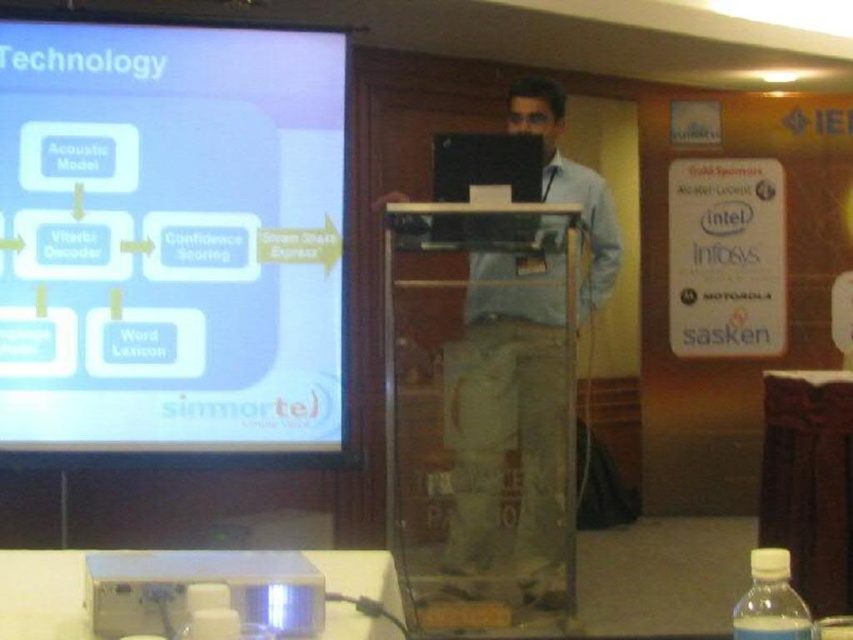
Does white plastic projector at lower left appear over clear plastic bottle at lower right?

Actually, white plastic projector at lower left is below clear plastic bottle at lower right.

Find the location of a particular element. white plastic projector at lower left is located at coordinates (202, 582).

Which is in front, point (252, 596) or point (763, 580)?

Point (763, 580) is more forward.

The height and width of the screenshot is (640, 853). Identify the location of white plastic projector at lower left. (202, 582).

Who is positioned more to the right, white glossy projector screen at upper left or clear plastic bottle at lower right?

Positioned to the right is clear plastic bottle at lower right.

Is the position of white glossy projector screen at upper left less distant than that of clear plastic bottle at lower right?

No, white glossy projector screen at upper left is further to the viewer.

Find the location of a particular element. The image size is (853, 640). white glossy projector screen at upper left is located at coordinates (170, 237).

Can you confirm if white glossy projector screen at upper left is positioned above matte black laptop at center?

Yes.

Does point (196, 38) come in front of point (548, 268)?

Yes, it is.

Which is in front, point (305, 396) or point (474, 307)?

Point (305, 396)

The image size is (853, 640). Find the location of `white glossy projector screen at upper left`. white glossy projector screen at upper left is located at coordinates (170, 237).